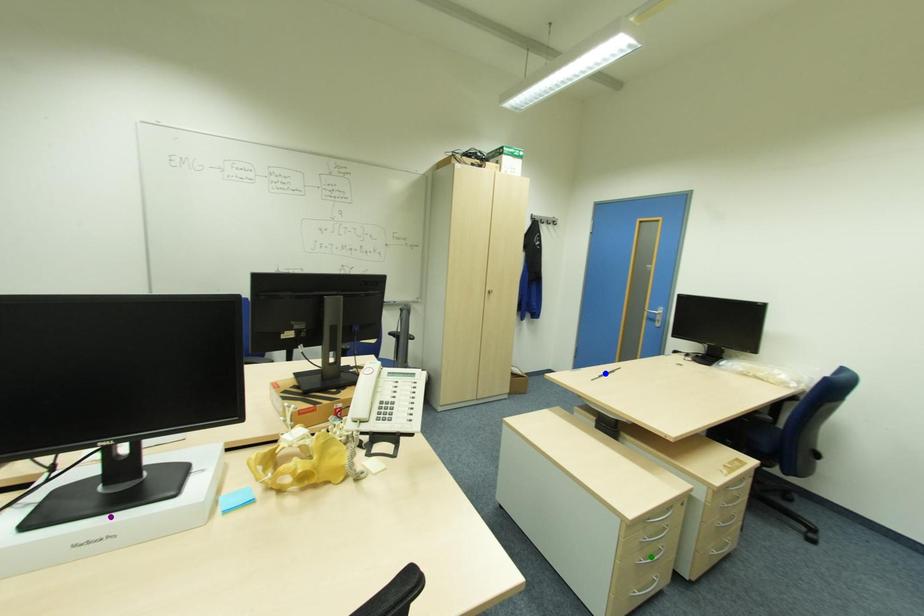
Order these from nearest to farthest:
1. blue point
2. purple point
3. green point

purple point
green point
blue point